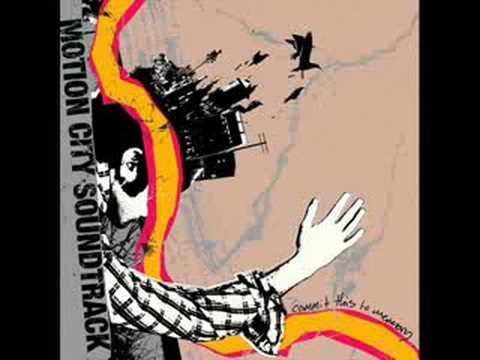
Image resolution: width=480 pixels, height=360 pixels. Find the location of `collage style art`. collage style art is located at coordinates (128, 144), (201, 304), (341, 235), (339, 336), (345, 321), (108, 31), (215, 102).